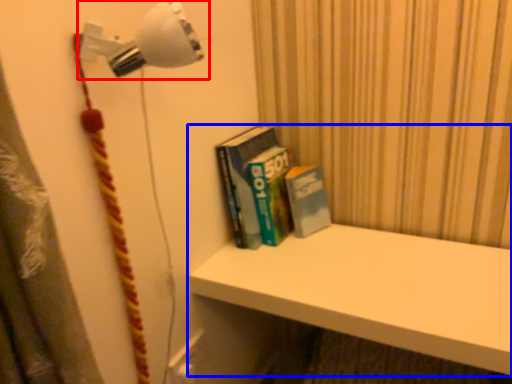
Question: Which object appears farthest to the camera in this image, lamp (highlighted by a red box) or shelf (highlighted by a blue box)?

Choices:
 (A) lamp
 (B) shelf

Answer: (B)